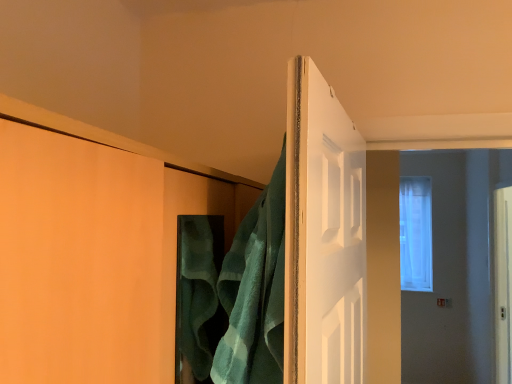
Question: Based on their positions, is translucent glass window at upper right located to the left or right of green terry cloth towel at center?

Choices:
 (A) left
 (B) right

Answer: (B)

Question: From a real-world perspective, relative to green terry cloth towel at center, is translucent glass window at upper right vertically above or below?

Choices:
 (A) above
 (B) below

Answer: (A)

Question: Looking at the image, does translucent glass window at upper right seem bigger or smaller compared to green terry cloth towel at center?

Choices:
 (A) small
 (B) big

Answer: (B)

Question: Looking at the image, does green terry cloth towel at center seem bigger or smaller compared to translucent glass window at upper right?

Choices:
 (A) small
 (B) big

Answer: (A)

Question: From the image's perspective, relative to translucent glass window at upper right, is green terry cloth towel at center above or below?

Choices:
 (A) below
 (B) above

Answer: (B)

Question: Considering the positions of green terry cloth towel at center and translucent glass window at upper right in the image, is green terry cloth towel at center taller or shorter than translucent glass window at upper right?

Choices:
 (A) short
 (B) tall

Answer: (A)

Question: Looking at their shapes, would you say green terry cloth towel at center is wider or thinner than translucent glass window at upper right?

Choices:
 (A) wide
 (B) thin

Answer: (B)